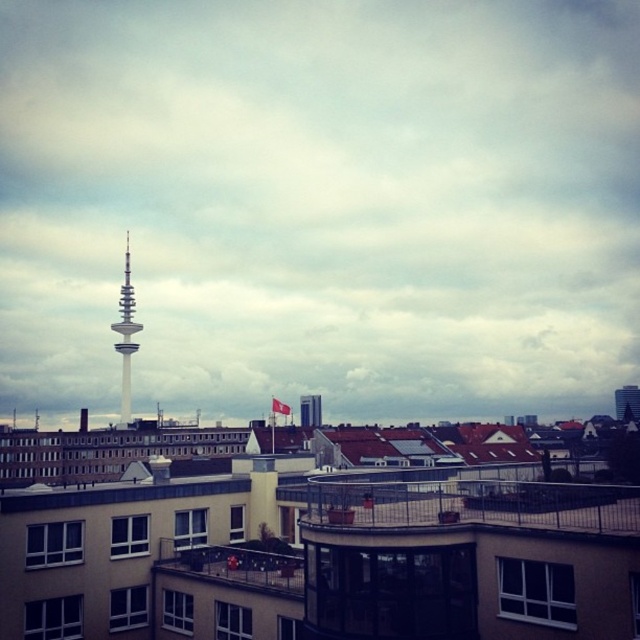
Question: Can you confirm if silver metallic tower at center is positioned to the left of white glass tv tower at center?

Choices:
 (A) no
 (B) yes

Answer: (B)

Question: Which object appears farthest from the camera in this image?

Choices:
 (A) silver metallic tower at center
 (B) white glass tv tower at center

Answer: (B)

Question: Considering the relative positions of silver metallic tower at center and white glass tv tower at center in the image provided, where is silver metallic tower at center located with respect to white glass tv tower at center?

Choices:
 (A) above
 (B) below

Answer: (A)

Question: Is silver metallic tower at center further to the viewer compared to white glass tv tower at center?

Choices:
 (A) yes
 (B) no

Answer: (B)

Question: Which of the following is the farthest from the observer?

Choices:
 (A) white glass tv tower at center
 (B) silver metallic tower at center

Answer: (A)